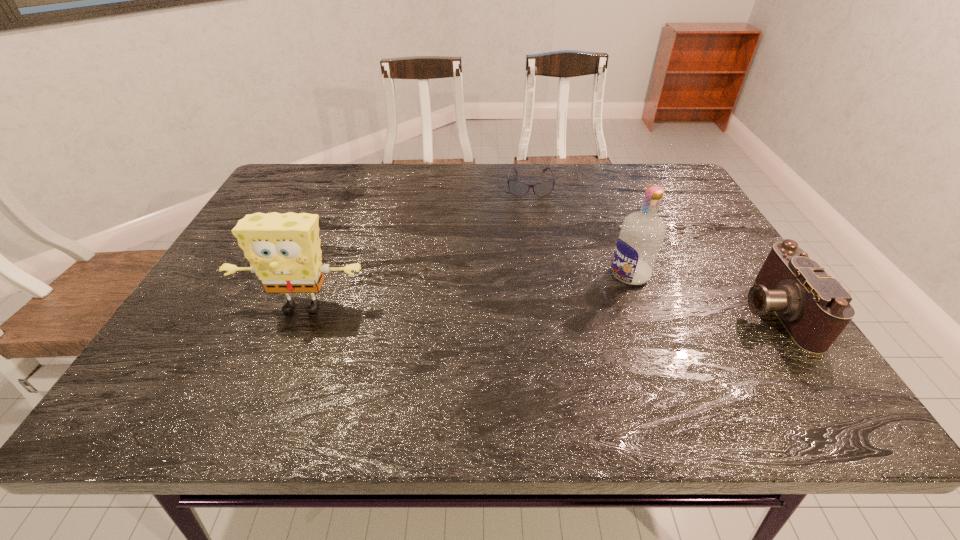
Where is `object that is at the near right corner`? object that is at the near right corner is located at coordinates click(814, 308).

This screenshot has height=540, width=960. In order to click on vacant space at the far edge in this screenshot , I will do `click(587, 201)`.

Identify the location of vacant space at the near edge of the desktop. (438, 363).

Locate an element on the screen. free space at the left edge of the desktop is located at coordinates (276, 206).

Find the location of a particular element. The height and width of the screenshot is (540, 960). vacant space at the right edge of the desktop is located at coordinates (671, 227).

Locate an element on the screen. The height and width of the screenshot is (540, 960). free spot between the leftmost object and the vodka is located at coordinates (467, 291).

The width and height of the screenshot is (960, 540). What are the coordinates of `unoccupied position between the farthest object and the vodka` in the screenshot? It's located at (580, 230).

The image size is (960, 540). I want to click on blank region between the shortest object and the vodka, so pos(580,230).

Image resolution: width=960 pixels, height=540 pixels. I want to click on unoccupied area between the vodka and the sponge, so click(x=467, y=291).

You are a GUI agent. You are given a task and a screenshot of the screen. Output one action in this format:
    pyautogui.click(x=<x>, y=<y>)
    Task: Click on the vacant point located between the third object from left to right and the shortest object
    
    Given the screenshot: What is the action you would take?
    pyautogui.click(x=580, y=230)